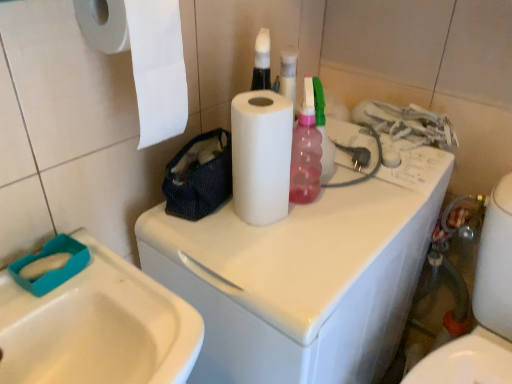
What do you see at coordinates (144, 57) in the screenshot?
I see `white paper at upper left, which is the first paper towel in left-to-right order` at bounding box center [144, 57].

The image size is (512, 384). In order to click on white glossy washing machine at center in this screenshot , I will do `click(305, 276)`.

The height and width of the screenshot is (384, 512). I want to click on white paper at upper left, which is the first paper towel in left-to-right order, so click(144, 57).

Locate an element on the screen. The width and height of the screenshot is (512, 384). paper towel behind the white glossy washing machine at center is located at coordinates (261, 156).

Is white glossy washing machine at center in front of or behind white matte paper towel at center, which is the first paper towel from right to left, in the image?

In the image, white glossy washing machine at center appears in front of white matte paper towel at center, which is the first paper towel from right to left.

Which is more to the left, white glossy washing machine at center or white matte paper towel at center, the 2th paper towel viewed from the left?

Answer: From the viewer's perspective, white matte paper towel at center, the 2th paper towel viewed from the left, appears more on the left side.

Does white paper at upper left, marked as the 2th paper towel in a right-to-left arrangement, come behind white matte paper towel at center, which is the first paper towel from right to left?

No, it is not.

Is white paper at upper left, marked as the 2th paper towel in a right-to-left arrangement, wider than white matte paper towel at center, which is the first paper towel from right to left?

Correct, the width of white paper at upper left, marked as the 2th paper towel in a right-to-left arrangement, exceeds that of white matte paper towel at center, which is the first paper towel from right to left.

Would you consider white paper at upper left, marked as the 2th paper towel in a right-to-left arrangement, to be distant from white matte paper towel at center, which is the first paper towel from right to left?

white paper at upper left, marked as the 2th paper towel in a right-to-left arrangement, is near white matte paper towel at center, which is the first paper towel from right to left, not far away.

Considering the sizes of objects white paper at upper left, marked as the 2th paper towel in a right-to-left arrangement, and white matte paper towel at center, which is the first paper towel from right to left, in the image provided, who is bigger, white paper at upper left, marked as the 2th paper towel in a right-to-left arrangement, or white matte paper towel at center, which is the first paper towel from right to left,?

With larger size is white paper at upper left, marked as the 2th paper towel in a right-to-left arrangement.

Is white glossy sink at lower left outside of white matte paper towel at center, the 2th paper towel viewed from the left?

white glossy sink at lower left lies outside white matte paper towel at center, the 2th paper towel viewed from the left,'s area.

Based on their sizes in the image, would you say white glossy sink at lower left is bigger or smaller than white matte paper towel at center, which is the first paper towel from right to left?

white glossy sink at lower left is bigger than white matte paper towel at center, which is the first paper towel from right to left.

From the image's perspective, is white glossy sink at lower left located above or below white matte paper towel at center, the 2th paper towel viewed from the left?

Clearly, from the image's perspective, white glossy sink at lower left is below white matte paper towel at center, the 2th paper towel viewed from the left.

Identify the location of the 2nd paper towel counting from the right of the white glossy sink at lower left. The image size is (512, 384). (261, 156).

Is white glossy sink at lower left taller than white paper at upper left, marked as the 2th paper towel in a right-to-left arrangement?

No.

Would you say white glossy sink at lower left is a long distance from white paper at upper left, marked as the 2th paper towel in a right-to-left arrangement?

No, white glossy sink at lower left is not far from white paper at upper left, marked as the 2th paper towel in a right-to-left arrangement.

The width and height of the screenshot is (512, 384). Identify the location of sink in front of the white paper at upper left, marked as the 2th paper towel in a right-to-left arrangement. coord(98,327).

Is white glossy sink at lower left positioned beyond the bounds of white paper at upper left, marked as the 2th paper towel in a right-to-left arrangement?

Absolutely, white glossy sink at lower left is external to white paper at upper left, marked as the 2th paper towel in a right-to-left arrangement.

Based on the photo, do you think white paper at upper left, marked as the 2th paper towel in a right-to-left arrangement, is within white glossy sink at lower left, or outside of it?

white paper at upper left, marked as the 2th paper towel in a right-to-left arrangement, exists outside the volume of white glossy sink at lower left.

In terms of height, does white paper at upper left, which is the first paper towel in left-to-right order, look taller or shorter compared to white glossy sink at lower left?

Clearly, white paper at upper left, which is the first paper towel in left-to-right order, is taller compared to white glossy sink at lower left.

Does white paper at upper left, which is the first paper towel in left-to-right order, turn towards white glossy sink at lower left?

No.

Is point (136, 21) more distant than point (98, 336)?

No, (136, 21) is in front of (98, 336).

Is white glossy toilet at lower right oriented towards white paper at upper left, marked as the 2th paper towel in a right-to-left arrangement?

No, white glossy toilet at lower right is not aimed at white paper at upper left, marked as the 2th paper towel in a right-to-left arrangement.

Is white glossy toilet at lower right located outside white paper at upper left, marked as the 2th paper towel in a right-to-left arrangement?

Yes, white glossy toilet at lower right is outside of white paper at upper left, marked as the 2th paper towel in a right-to-left arrangement.

Considering the sizes of objects white glossy toilet at lower right and white paper at upper left, which is the first paper towel in left-to-right order, in the image provided, who is thinner, white glossy toilet at lower right or white paper at upper left, which is the first paper towel in left-to-right order,?

white glossy toilet at lower right is thinner.

Which is more to the left, white glossy toilet at lower right or white paper at upper left, which is the first paper towel in left-to-right order?

From the viewer's perspective, white paper at upper left, which is the first paper towel in left-to-right order, appears more on the left side.

Is white matte paper towel at center, which is the first paper towel from right to left, outside of white glossy washing machine at center?

Absolutely, white matte paper towel at center, which is the first paper towel from right to left, is external to white glossy washing machine at center.

In the image, is white matte paper towel at center, the 2th paper towel viewed from the left, positioned in front of or behind white glossy washing machine at center?

white matte paper towel at center, the 2th paper towel viewed from the left, is positioned farther from the viewer than white glossy washing machine at center.

Is white matte paper towel at center, the 2th paper towel viewed from the left, bigger than white glossy washing machine at center?

No, white matte paper towel at center, the 2th paper towel viewed from the left, is not bigger than white glossy washing machine at center.

Is white matte paper towel at center, the 2th paper towel viewed from the left, to the right of white glossy washing machine at center from the viewer's perspective?

No.

Image resolution: width=512 pixels, height=384 pixels. In order to click on washing machine that appears in front of the white matte paper towel at center, the 2th paper towel viewed from the left in this screenshot , I will do `click(305, 276)`.

Where is `paper towel above the white matte paper towel at center, which is the first paper towel from right to left (from a real-world perspective)`? paper towel above the white matte paper towel at center, which is the first paper towel from right to left (from a real-world perspective) is located at coordinates (144, 57).

Looking at the image, which one is located further to white glossy washing machine at center, white matte paper towel at center, which is the first paper towel from right to left, or white glossy sink at lower left?

white glossy sink at lower left lies further to white glossy washing machine at center than the other object.

Looking at the image, which one is located closer to white matte paper towel at center, the 2th paper towel viewed from the left, white paper at upper left, marked as the 2th paper towel in a right-to-left arrangement, or white glossy toilet at lower right?

white paper at upper left, marked as the 2th paper towel in a right-to-left arrangement, lies closer to white matte paper towel at center, the 2th paper towel viewed from the left, than the other object.

Based on their spatial positions, is white paper at upper left, which is the first paper towel in left-to-right order, or white glossy sink at lower left closer to white glossy toilet at lower right?

white glossy sink at lower left lies closer to white glossy toilet at lower right than the other object.

Looking at this image, based on their spatial positions, is white glossy toilet at lower right or white glossy sink at lower left further from white matte paper towel at center, the 2th paper towel viewed from the left?

white glossy toilet at lower right is positioned further to the anchor white matte paper towel at center, the 2th paper towel viewed from the left.

In the scene shown: From the image, which object appears to be nearer to white paper at upper left, marked as the 2th paper towel in a right-to-left arrangement, white matte paper towel at center, which is the first paper towel from right to left, or white glossy sink at lower left?

white matte paper towel at center, which is the first paper towel from right to left.

Based on their spatial positions, is white paper at upper left, marked as the 2th paper towel in a right-to-left arrangement, or white glossy washing machine at center further from white matte paper towel at center, which is the first paper towel from right to left?

white glossy washing machine at center is positioned further to the anchor white matte paper towel at center, which is the first paper towel from right to left.

From the image, which object appears to be nearer to white glossy toilet at lower right, white matte paper towel at center, which is the first paper towel from right to left, or white glossy washing machine at center?

white glossy washing machine at center is closer to white glossy toilet at lower right.

Estimate the real-world distances between objects in this image. Which object is closer to white glossy washing machine at center, white paper at upper left, which is the first paper towel in left-to-right order, or white matte paper towel at center, the 2th paper towel viewed from the left?

white matte paper towel at center, the 2th paper towel viewed from the left.

Where is `sink between white matte paper towel at center, the 2th paper towel viewed from the left, and white glossy washing machine at center from top to bottom`? The image size is (512, 384). sink between white matte paper towel at center, the 2th paper towel viewed from the left, and white glossy washing machine at center from top to bottom is located at coordinates (98, 327).

What are the coordinates of `paper towel between white paper at upper left, marked as the 2th paper towel in a right-to-left arrangement, and white glossy toilet at lower right, in the horizontal direction` in the screenshot? It's located at (261, 156).

At what (x,y) coordinates should I click in order to perform the action: click on washing machine located between white paper at upper left, marked as the 2th paper towel in a right-to-left arrangement, and white glossy toilet at lower right in the left-right direction. Please return your answer as a coordinate pair (x, y). Looking at the image, I should click on (305, 276).

Image resolution: width=512 pixels, height=384 pixels. In order to click on paper towel that lies between white paper at upper left, marked as the 2th paper towel in a right-to-left arrangement, and white glossy washing machine at center from top to bottom in this screenshot , I will do `click(261, 156)`.